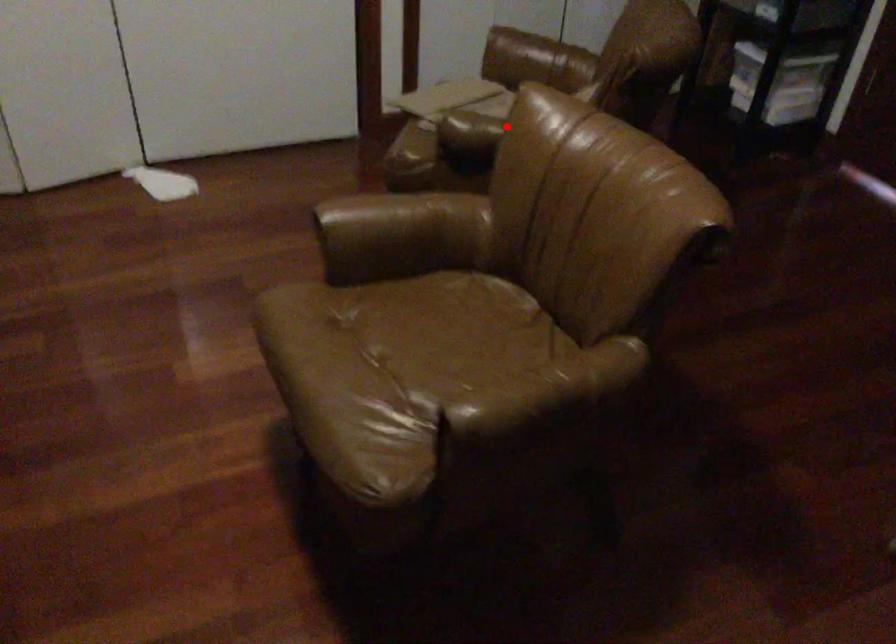
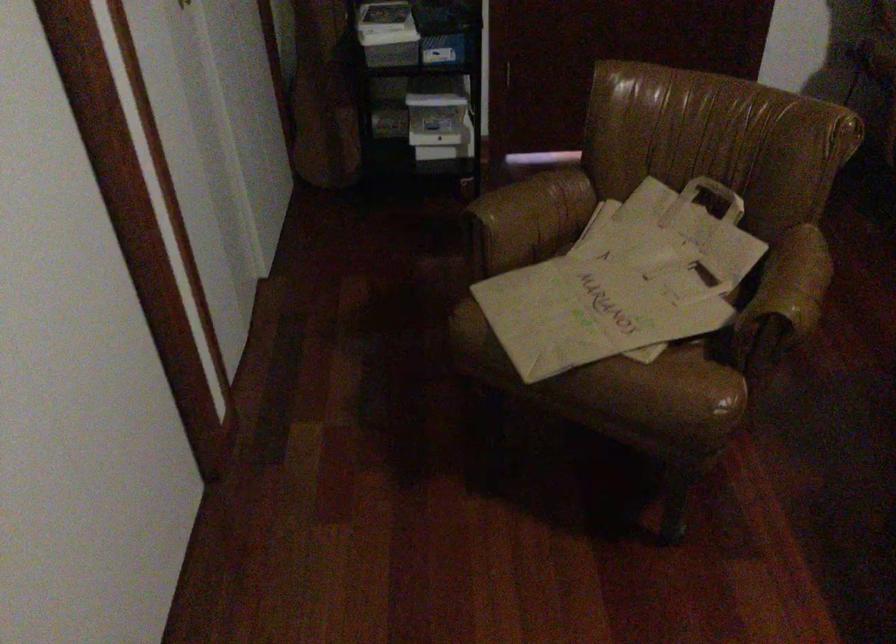
Where in the second image is the point corresponding to the highlighted location from the first image?

(803, 275)